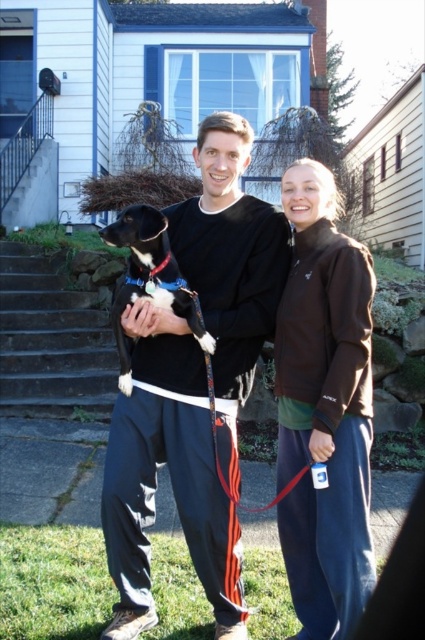
Question: Does black matte dog at center lie in front of matte brown jacket at center?

Choices:
 (A) yes
 (B) no

Answer: (B)

Question: Does matte brown jacket at center have a larger size compared to concrete stairs at lower left?

Choices:
 (A) no
 (B) yes

Answer: (A)

Question: Which of the following is the closest to the observer?

Choices:
 (A) 14,305
 (B) 339,452
 (C) 161,227
 (D) 163,440

Answer: (B)

Question: Is matte brown jacket at center above concrete stairs at lower left?

Choices:
 (A) yes
 (B) no

Answer: (B)

Question: Which point appears closest to the camera in this image?

Choices:
 (A) (161, 371)
 (B) (48, 364)
 (C) (367, 477)
 (D) (189, 305)

Answer: (C)

Question: Which point is farther from the camera taking this photo?

Choices:
 (A) (274, 243)
 (B) (125, 280)
 (C) (62, 333)
 (D) (314, 502)

Answer: (C)